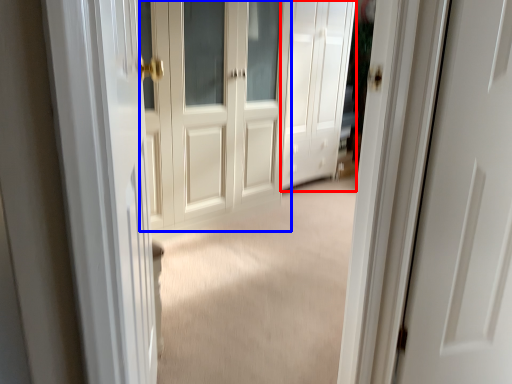
Question: Which object is further to the camera taking this photo, door (highlighted by a red box) or door (highlighted by a blue box)?

Choices:
 (A) door
 (B) door

Answer: (A)